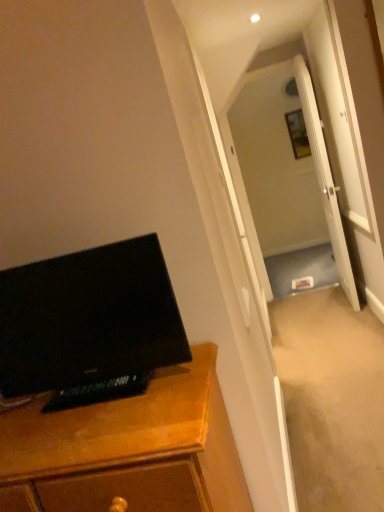
This screenshot has height=512, width=384. I want to click on space that is in front of black glossy monitor at left, so click(x=89, y=428).